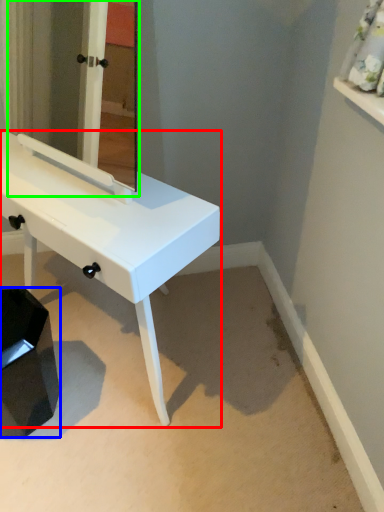
Question: Considering the real-world distances, which object is farthest from table (highlighted by a red box)? step stool (highlighted by a blue box) or mirror (highlighted by a green box)?

Choices:
 (A) step stool
 (B) mirror

Answer: (B)